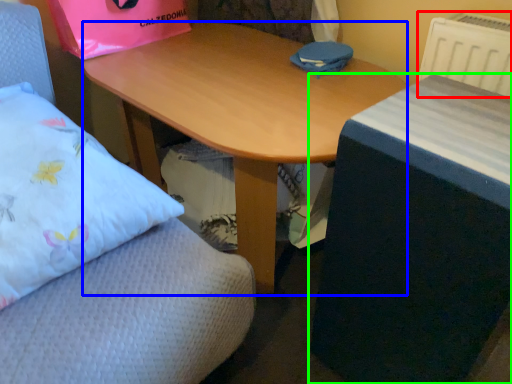
Question: Which object is the farthest from radiator (highlighted by a red box)? Choose among these: desk (highlighted by a blue box) or table (highlighted by a green box).

Choices:
 (A) desk
 (B) table

Answer: (A)